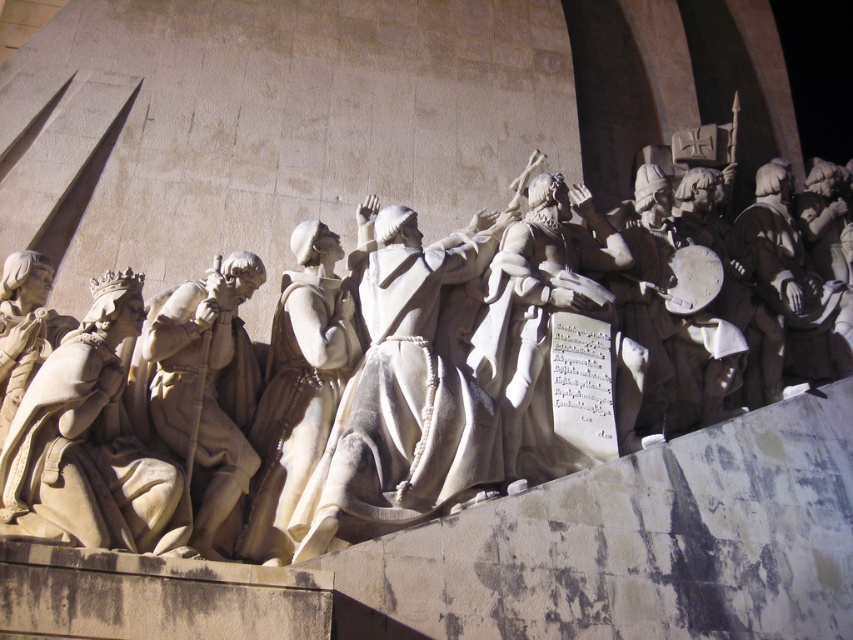
You are an art conservator examining the sculpture. You notice two points on the pedestal with different levels of weathering. The first point is at coordinates point (67,406) and the second is at point (204,422). Based on their positions, which point is more likely to be exposed to direct sunlight and thus more weathered?

Point (67,406) is closer to the camera than point (204,422), so it is more likely to be exposed to direct sunlight and thus more weathered.

You are an art conservator assessing the stone sculptures in the image. You need to determine which statue has a greater width between the white stone statue at center and the beige stone statue at left. Based on the scene, which one is wider?

The white stone statue at center is wider than the beige stone statue at left.

You are an art conservator examining the sculpture. You need to clean the white stone statue at center and the white marble statue at left. Which statue should you start with if you want to work on the one closer to you first?

The white stone statue at center is closer to the viewer than the white marble statue at left, so you should start cleaning the white stone statue at center first.